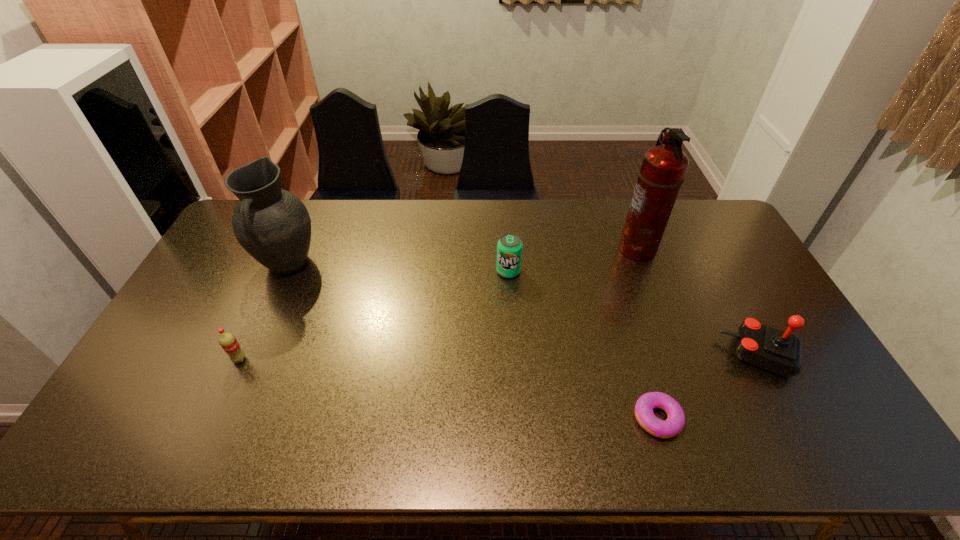
Identify the location of vacant area situated on the nozzle side of the tallest object. (604, 248).

This screenshot has width=960, height=540. Find the location of `free spot located 0.360m on the nozzle side of the tallest object`. free spot located 0.360m on the nozzle side of the tallest object is located at coordinates (515, 248).

Where is `blank area located 0.390m on the side of the pitcher with the handle`? This screenshot has width=960, height=540. blank area located 0.390m on the side of the pitcher with the handle is located at coordinates pyautogui.click(x=225, y=403).

Find the location of a particular element. The width and height of the screenshot is (960, 540). vacant area situated 0.080m on the back of the fourth shortest object is located at coordinates (735, 309).

Identify the location of vacant space situated 0.200m on the front-facing side of the right soda. (512, 329).

At what (x,y) coordinates should I click in order to perform the action: click on vacant area situated on the front of the nearer soda. Please return your answer as a coordinate pair (x, y). The image size is (960, 540). Looking at the image, I should click on (229, 381).

This screenshot has width=960, height=540. Identify the location of free spot located on the left of the shortest object. (483, 418).

The image size is (960, 540). Find the location of `object located at the far edge`. object located at the far edge is located at coordinates (663, 168).

Where is `object that is at the near edge`? The image size is (960, 540). object that is at the near edge is located at coordinates (673, 425).

The width and height of the screenshot is (960, 540). I want to click on object that is at the left edge, so click(273, 225).